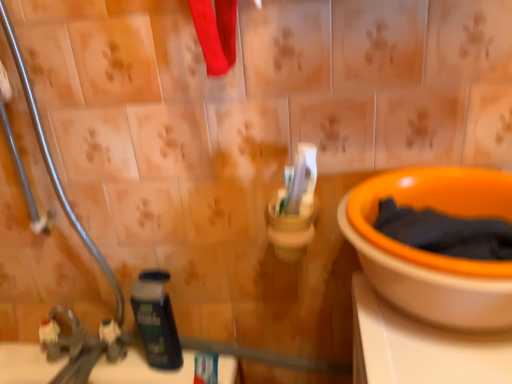
Question: Can you confirm if orange plastic bowl at right is taller than dark blue plastic shaving cream at lower left?

Choices:
 (A) no
 (B) yes

Answer: (A)

Question: From the image's perspective, is orange plastic bowl at right beneath dark blue plastic shaving cream at lower left?

Choices:
 (A) yes
 (B) no

Answer: (B)

Question: Is orange plastic bowl at right positioned beyond the bounds of dark blue plastic shaving cream at lower left?

Choices:
 (A) yes
 (B) no

Answer: (A)

Question: Does orange plastic bowl at right have a greater width compared to dark blue plastic shaving cream at lower left?

Choices:
 (A) yes
 (B) no

Answer: (A)

Question: Can you confirm if orange plastic bowl at right is smaller than dark blue plastic shaving cream at lower left?

Choices:
 (A) yes
 (B) no

Answer: (B)

Question: Looking at their shapes, would you say white matte toothpaste at lower center is wider or thinner than orange plastic bowl at right?

Choices:
 (A) wide
 (B) thin

Answer: (B)

Question: Is point (215, 357) positioned closer to the camera than point (463, 178)?

Choices:
 (A) farther
 (B) closer

Answer: (A)

Question: From the image's perspective, is white matte toothpaste at lower center above or below orange plastic bowl at right?

Choices:
 (A) above
 (B) below

Answer: (B)

Question: Choose the correct answer: Is white matte toothpaste at lower center inside orange plastic bowl at right or outside it?

Choices:
 (A) outside
 (B) inside

Answer: (A)

Question: Is point (74, 230) closer or farther from the camera than point (145, 319)?

Choices:
 (A) closer
 (B) farther

Answer: (B)

Question: Would you say metallic silver pipe at left is to the left or to the right of dark blue plastic shaving cream at lower left in the picture?

Choices:
 (A) left
 (B) right

Answer: (A)

Question: Considering the positions of metallic silver pipe at left and dark blue plastic shaving cream at lower left in the image, is metallic silver pipe at left wider or thinner than dark blue plastic shaving cream at lower left?

Choices:
 (A) thin
 (B) wide

Answer: (B)

Question: From a real-world perspective, is metallic silver pipe at left positioned above or below dark blue plastic shaving cream at lower left?

Choices:
 (A) below
 (B) above

Answer: (B)

Question: Based on their positions, is metallic silver pipe at left located to the left or right of white matte toothpaste at lower center?

Choices:
 (A) right
 (B) left

Answer: (B)

Question: Is metallic silver pipe at left in front of or behind white matte toothpaste at lower center in the image?

Choices:
 (A) front
 (B) behind

Answer: (A)